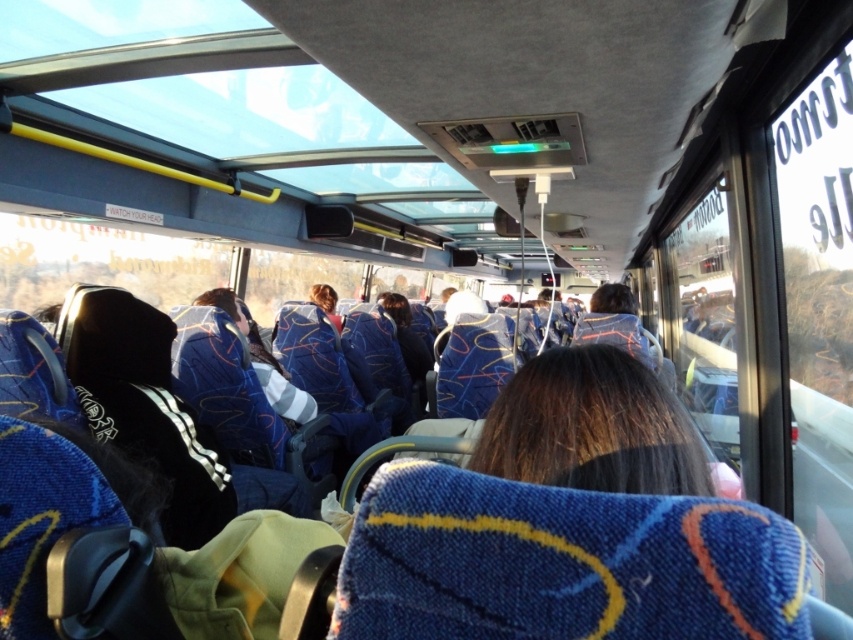
Between point (674, 449) and point (258, 380), which one is positioned in front?

Point (674, 449) is more forward.

At what (x,y) coordinates should I click in order to perform the action: click on brown hair at center. Please return your answer as a coordinate pair (x, y). Looking at the image, I should click on (590, 428).